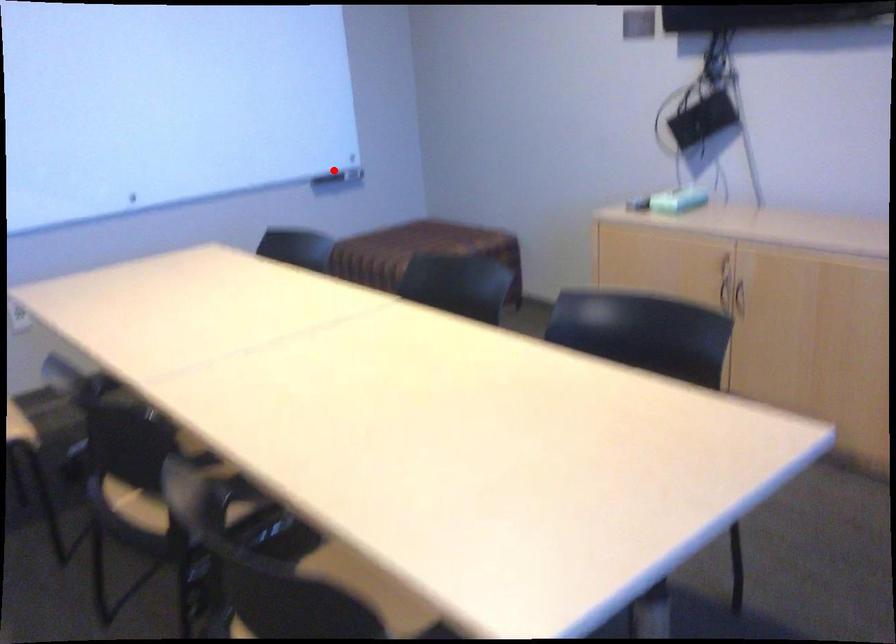
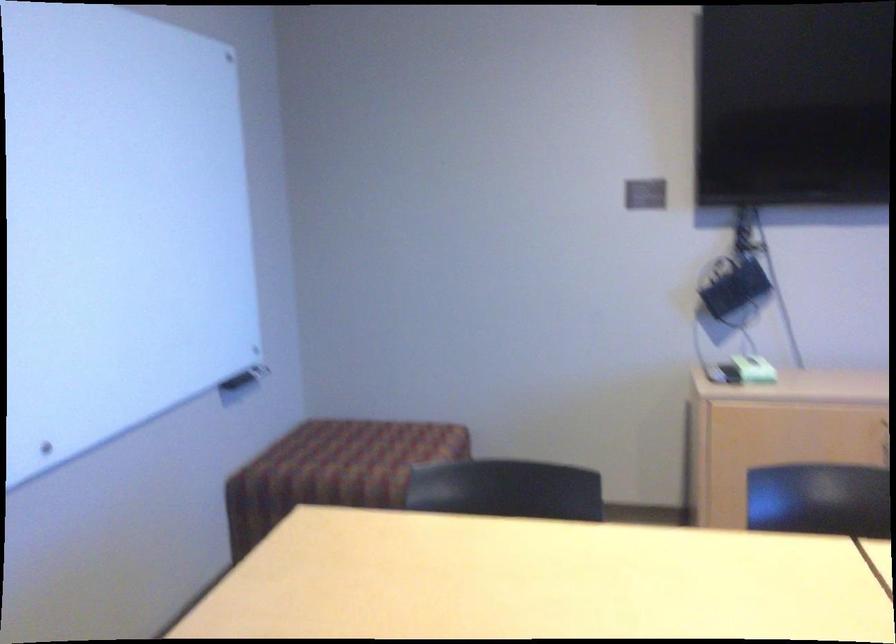
Question: I am providing you with two images of the same scene from different viewpoints. Image1 has a red point marked. In image2, the corresponding 3D location appears at what relative position? Reply with the corresponding letter.

Choices:
 (A) Closer
 (B) Farther

Answer: (A)